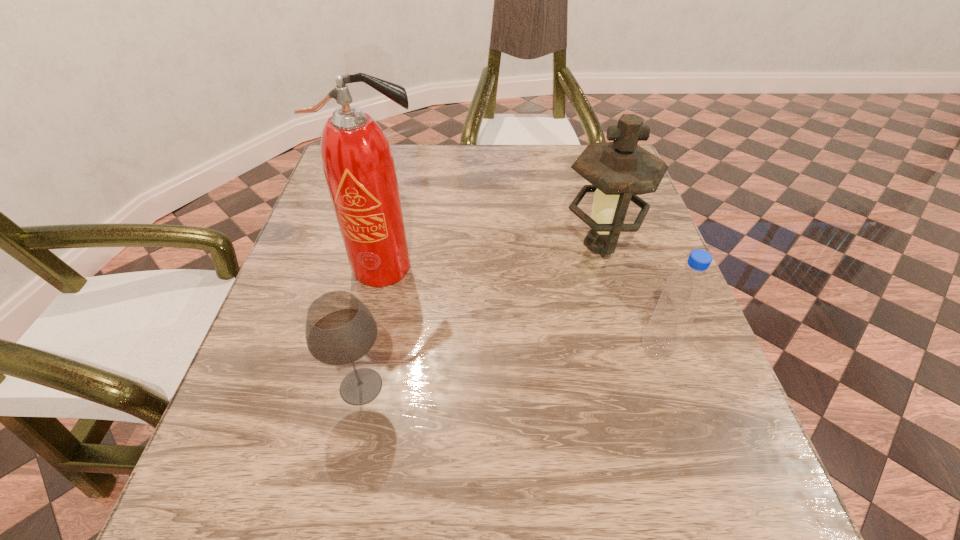
At what (x,y) coordinates should I click in order to perform the action: click on unoccupied position between the fire extinguisher and the water bottle. Please return your answer as a coordinate pair (x, y). The width and height of the screenshot is (960, 540). Looking at the image, I should click on (521, 308).

At what (x,y) coordinates should I click in order to perform the action: click on vacant space in between the fire extinguisher and the second tallest object. Please return your answer as a coordinate pair (x, y). Looking at the image, I should click on point(492,256).

The image size is (960, 540). Identify the location of free spot between the second tallest object and the water bottle. (629, 297).

This screenshot has height=540, width=960. In order to click on free space between the oil lamp and the water bottle in this screenshot , I will do `click(629, 297)`.

What are the coordinates of `object that ranks as the closest to the tallest object` in the screenshot? It's located at (340, 329).

Locate an element on the screen. This screenshot has width=960, height=540. the second closest object to the fire extinguisher is located at coordinates (619, 171).

Locate an element on the screen. The height and width of the screenshot is (540, 960). vacant space that satisfies the following two spatial constraints: 1. on the front side of the fire extinguisher; 2. on the left side of the wineglass is located at coordinates (361, 386).

Where is `vacant area in the image that satisfies the following two spatial constraints: 1. on the front side of the tallest object; 2. on the left side of the water bottle`? The width and height of the screenshot is (960, 540). vacant area in the image that satisfies the following two spatial constraints: 1. on the front side of the tallest object; 2. on the left side of the water bottle is located at coordinates (369, 349).

Identify the location of free spot that satisfies the following two spatial constraints: 1. on the front side of the shortest object; 2. on the right side of the tallest object. (361, 386).